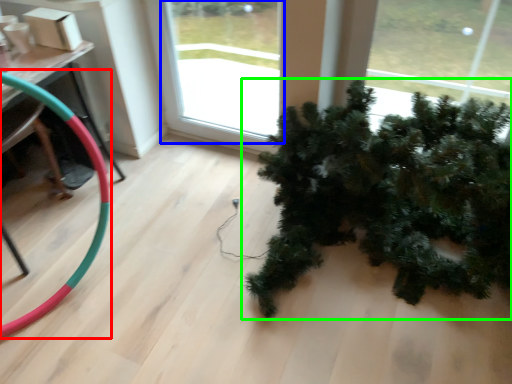
Question: Considering the real-world distances, which object is farthest from garden hose (highlighted by a red box)? window (highlighted by a blue box) or houseplant (highlighted by a green box)?

Choices:
 (A) window
 (B) houseplant

Answer: (A)